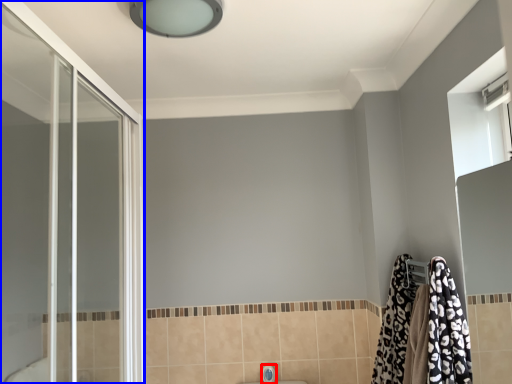
Question: Which of the following is the closest to the observer, faucet (highlighted by a red box) or screen door (highlighted by a blue box)?

Choices:
 (A) faucet
 (B) screen door

Answer: (B)